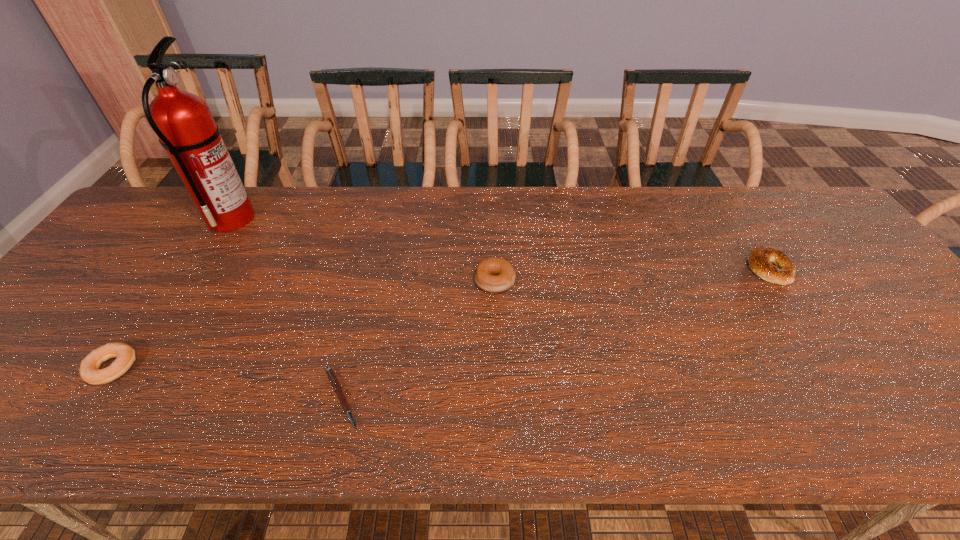
Identify the location of the tallest object. The image size is (960, 540). (186, 129).

This screenshot has width=960, height=540. In order to click on fire extinguisher in this screenshot , I will do `click(186, 129)`.

Find the location of a particular element. The image size is (960, 540). the tallest bagel is located at coordinates (494, 275).

The height and width of the screenshot is (540, 960). In order to click on the second bagel from left to right in this screenshot , I will do `click(494, 275)`.

This screenshot has height=540, width=960. Identify the location of the rightmost bagel. (761, 259).

You are a GUI agent. You are given a task and a screenshot of the screen. Output one action in this format:
    pyautogui.click(x=<x>, y=<y>)
    Task: Click on the nearest bagel
    The image size is (960, 540).
    Given the screenshot: What is the action you would take?
    pyautogui.click(x=90, y=372)

I want to click on the shortest object, so click(x=330, y=373).

The image size is (960, 540). What are the coordinates of `the third object from right to left` in the screenshot? It's located at (330, 373).

At what (x,y) coordinates should I click in order to perform the action: click on blank space located 0.050m at the nozzle of the fire extinguisher. Please return your answer as a coordinate pair (x, y). Image resolution: width=960 pixels, height=540 pixels. Looking at the image, I should click on pyautogui.click(x=271, y=218).

Where is `vacant space located 0.070m on the front of the fourth shortest object`? Image resolution: width=960 pixels, height=540 pixels. vacant space located 0.070m on the front of the fourth shortest object is located at coordinates (496, 318).